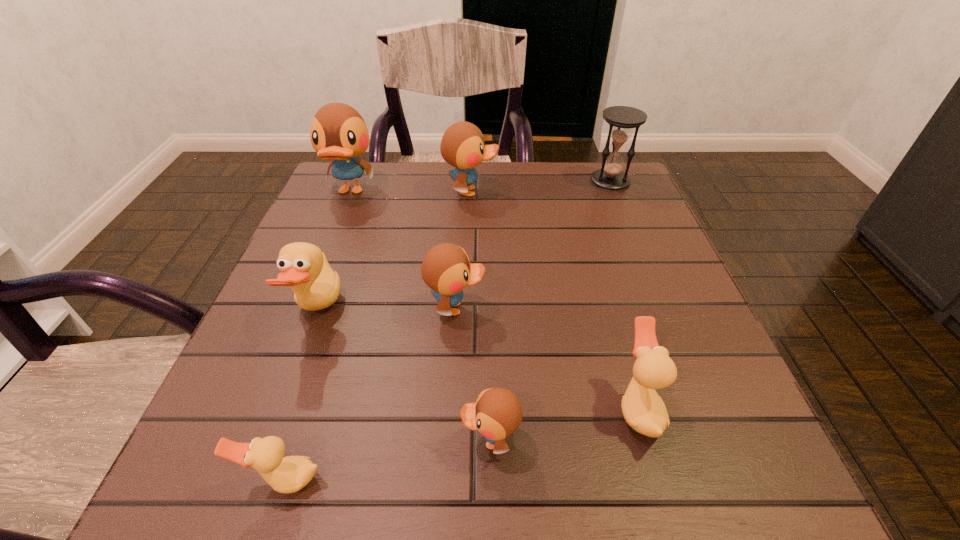
Where is `free space between the rightmost object and the biggest tan duck`? free space between the rightmost object and the biggest tan duck is located at coordinates (464, 246).

Image resolution: width=960 pixels, height=540 pixels. In order to click on free space that is in between the second smallest blue duck and the biggest blue duck in this screenshot , I will do `click(403, 249)`.

Where is `free space between the rightmost duck and the farthest tan duck`? The height and width of the screenshot is (540, 960). free space between the rightmost duck and the farthest tan duck is located at coordinates (478, 359).

Locate an element on the screen. vacant space that is in between the third smallest blue duck and the smallest blue duck is located at coordinates (481, 315).

Identify the location of object that is the sixth closest to the biggest tan duck. (643, 409).

Identify which object is the fourth nearest to the farthest tan duck. Please provide its 2D coordinates. Your answer should be formatted as a tuple, i.e. [(x, y)], where the tuple contains the x and y coordinates of a point satisfying the conditions above.

[(497, 414)]

The width and height of the screenshot is (960, 540). In order to click on the fifth closest duck to the farthest tan duck in this screenshot , I will do `click(462, 146)`.

Identify which duck is the fifth nearest to the nearest blue duck. Please provide its 2D coordinates. Your answer should be formatted as a tuple, i.e. [(x, y)], where the tuple contains the x and y coordinates of a point satisfying the conditions above.

[(462, 146)]

At what (x,y) coordinates should I click in order to perform the action: click on the closest blue duck relative to the biggest tan duck. Please return your answer as a coordinate pair (x, y). Looking at the image, I should click on (446, 269).

Identify the location of blue duck identified as the second closest to the black hourglass. The height and width of the screenshot is (540, 960). (446, 269).